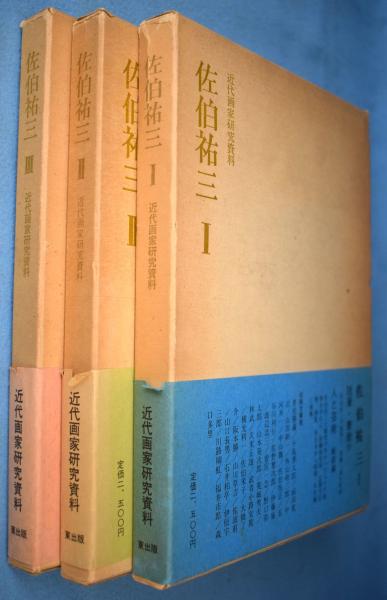
I want to click on orange book bindings, so click(148, 339), click(76, 330), click(24, 325).